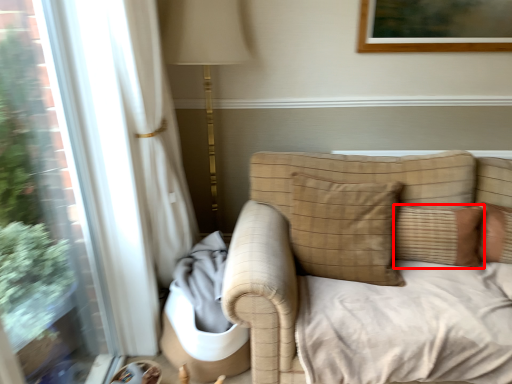
Question: From the image's perspective, where is pillow (annotated by the red box) located relative to pillow?

Choices:
 (A) above
 (B) below

Answer: (B)